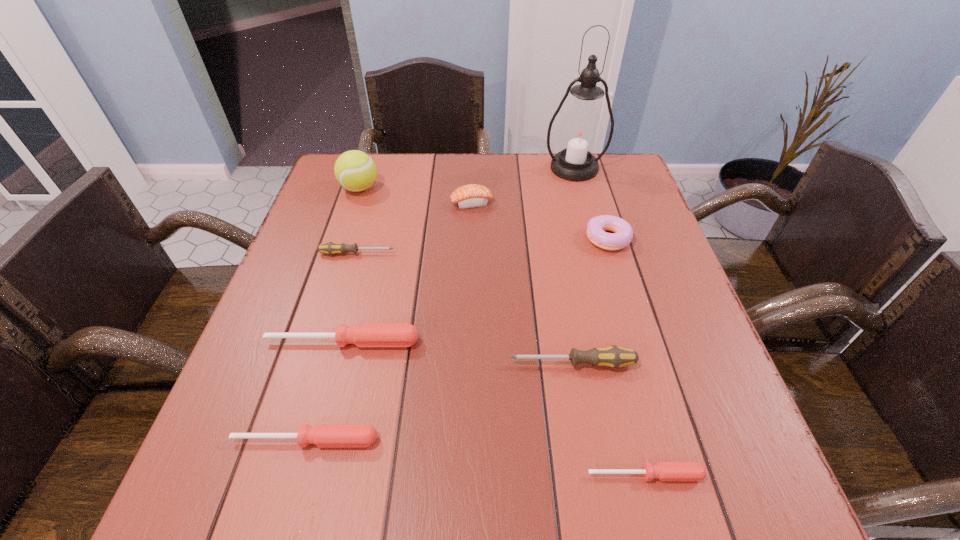
The width and height of the screenshot is (960, 540). What are the coordinates of `free space in the image that satisfies the following two spatial constraints: 1. at the tip of the third nearest screwdriver; 2. on the right side of the nearest red screwdriver` in the screenshot? It's located at (591, 475).